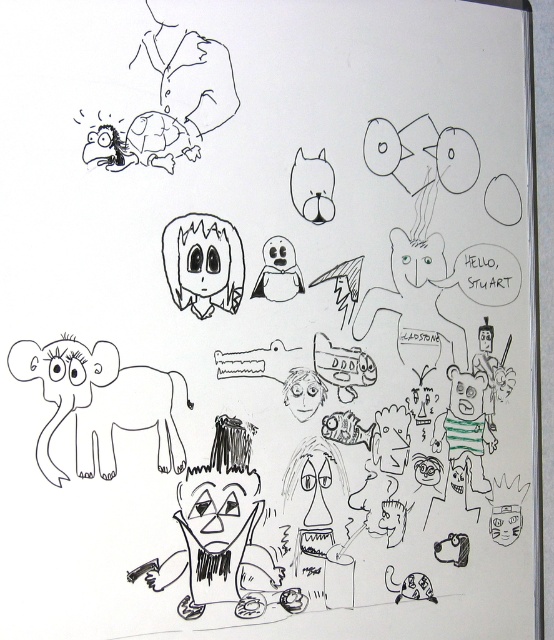
You are an artist trying to fit both the black line art face at center and the matte black cat at center into a frame. Based on their sizes, which one should you place first to ensure they both fit?

The black line art face at center is wider than the matte black cat at center, so you should place the smaller matte black cat at center first to ensure there is enough space for the larger black line art face at center.

From the picture: You are an artist who wants to draw a new animal between the matte black elephant at lower left and the matte black cat at center. Considering their heights, which animal should be placed higher to maintain visual balance?

The matte black elephant at lower left is taller than the matte black cat at center, so to maintain visual balance, the new animal should be placed higher near the matte black cat at center to counterbalance the taller elephant.